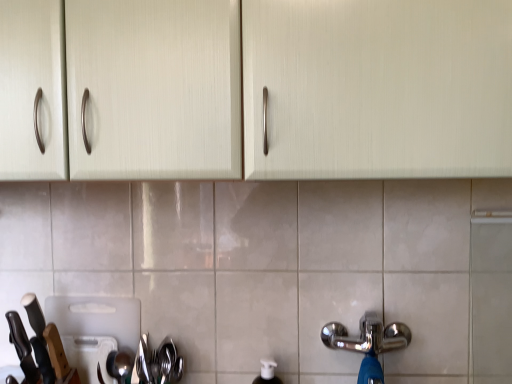
Question: From a real-world perspective, is satin silver spoon at lower left, positioned as the second appliance in back-to-front order, located beneath black matte knife at left, positioned as the 2th knife in left-to-right order?

Choices:
 (A) no
 (B) yes

Answer: (B)

Question: From the image's perspective, is satin silver spoon at lower left, positioned as the first appliance in front-to-back order, located above black matte knife at left, positioned as the 2th knife in left-to-right order?

Choices:
 (A) no
 (B) yes

Answer: (A)

Question: Considering the relative positions of satin silver spoon at lower left, positioned as the second appliance in back-to-front order, and black matte knife at left, positioned as the 2th knife in left-to-right order, in the image provided, is satin silver spoon at lower left, positioned as the second appliance in back-to-front order, to the left of black matte knife at left, positioned as the 2th knife in left-to-right order, from the viewer's perspective?

Choices:
 (A) yes
 (B) no

Answer: (B)

Question: Is satin silver spoon at lower left, positioned as the first appliance in front-to-back order, positioned with its back to black matte knife at left, the 1th knife from the right?

Choices:
 (A) yes
 (B) no

Answer: (B)

Question: Is the position of satin silver spoon at lower left, positioned as the second appliance in back-to-front order, less distant than that of black matte knife at left, the 1th knife from the right?

Choices:
 (A) yes
 (B) no

Answer: (B)

Question: Does satin silver spoon at lower left, positioned as the second appliance in back-to-front order, have a lesser width compared to black matte knife at left, the 1th knife from the right?

Choices:
 (A) yes
 (B) no

Answer: (A)

Question: Does white plastic cutting board at lower left, acting as the first appliance starting from the back, have a larger size compared to shiny metallic spoon at lower left?

Choices:
 (A) yes
 (B) no

Answer: (A)

Question: Does white plastic cutting board at lower left, acting as the first appliance starting from the back, have a lesser width compared to shiny metallic spoon at lower left?

Choices:
 (A) no
 (B) yes

Answer: (B)

Question: Is white plastic cutting board at lower left, acting as the first appliance starting from the back, completely or partially outside of shiny metallic spoon at lower left?

Choices:
 (A) yes
 (B) no

Answer: (A)

Question: Does white plastic cutting board at lower left, the second appliance when ordered from front to back, appear on the left side of shiny metallic spoon at lower left?

Choices:
 (A) no
 (B) yes

Answer: (B)

Question: Could you tell me if white plastic cutting board at lower left, acting as the first appliance starting from the back, is turned towards shiny metallic spoon at lower left?

Choices:
 (A) yes
 (B) no

Answer: (A)

Question: Is white plastic cutting board at lower left, acting as the first appliance starting from the back, shorter than shiny metallic spoon at lower left?

Choices:
 (A) yes
 (B) no

Answer: (B)

Question: Is satin silver spoon at lower left, positioned as the second appliance in back-to-front order, oriented away from matte cream cabinet at upper center?

Choices:
 (A) yes
 (B) no

Answer: (B)